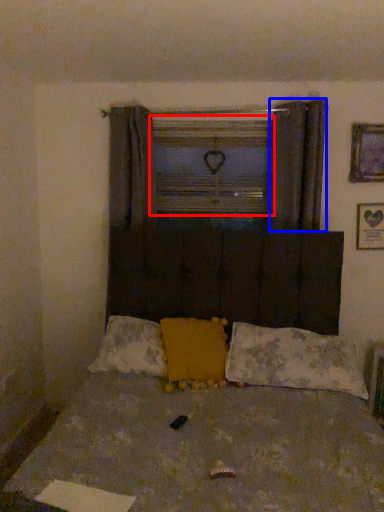
Question: Which object appears closest to the camera in this image, window frame (highlighted by a red box) or curtain (highlighted by a blue box)?

Choices:
 (A) window frame
 (B) curtain

Answer: (B)